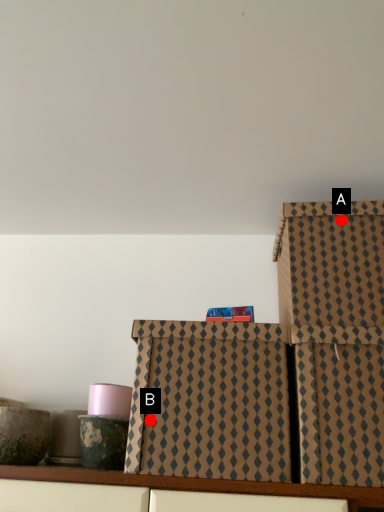
Question: Two points are circled on the image, labeled by A and B beside each circle. Which point is further to the camera?

Choices:
 (A) A is further
 (B) B is further

Answer: (A)